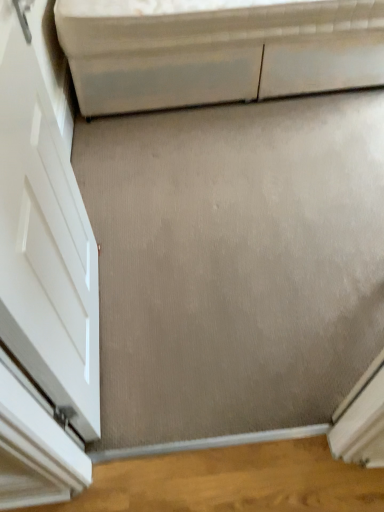
Where is `vacant space in white glossy door at left (from a real-world perspective)`? vacant space in white glossy door at left (from a real-world perspective) is located at coordinates (102, 328).